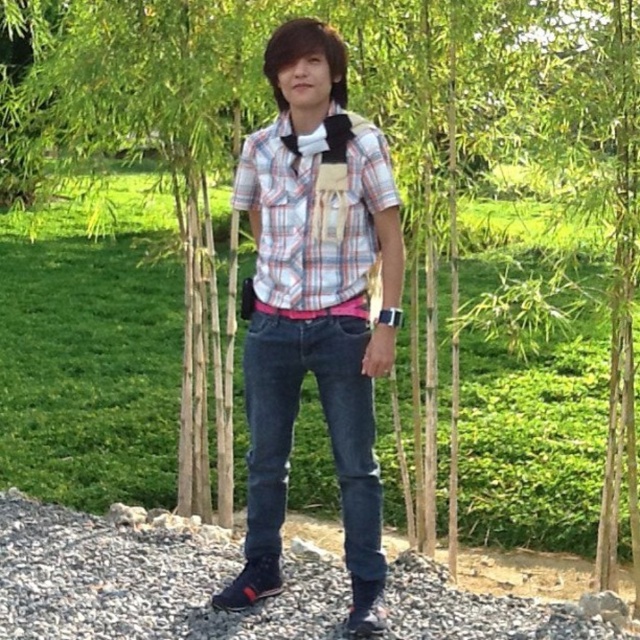
Question: Does plaid cotton shirt at center have a lesser width compared to gray gravel at lower center?

Choices:
 (A) no
 (B) yes

Answer: (B)

Question: Can you confirm if plaid cotton shirt at center is wider than dark blue denim jeans at center?

Choices:
 (A) yes
 (B) no

Answer: (A)

Question: Among these points, which one is nearest to the camera?

Choices:
 (A) (284, 390)
 (B) (332, 340)
 (C) (301, 625)
 (D) (346, 257)

Answer: (D)

Question: Can you confirm if plaid cotton shirt at center is bigger than plaid shirt at center?

Choices:
 (A) no
 (B) yes

Answer: (B)

Question: Which point is farther from the camera taking this photo?

Choices:
 (A) (378, 630)
 (B) (376, 483)

Answer: (B)

Question: Which point is farther from the camera taking this photo?

Choices:
 (A) (392, 193)
 (B) (266, 248)
 (C) (294, 362)

Answer: (C)